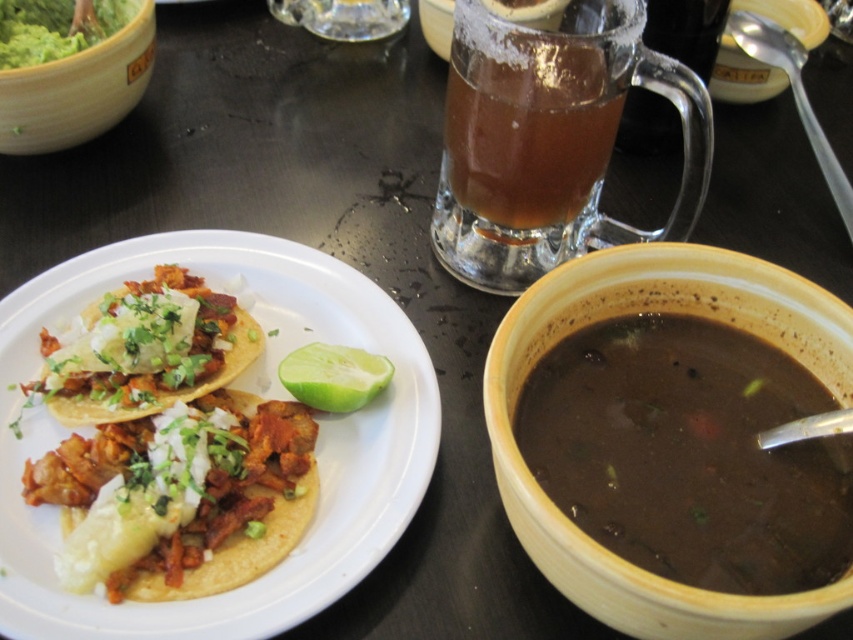
You are a diner sitting at the table in the image. You want to reach for the brown stoneware bowl at center right but need to pass by the shiny silver tacos at left. Can you move your hand from the tacos to the bowl without moving any objects?

Yes, you can move your hand from the shiny silver tacos at left to the brown stoneware bowl at center right because the bowl is positioned to the right of the tacos, allowing a clear path between them.

You are a food critic evaluating the meal setup on the dark wooden table. You notice two shiny silver items at the left side of the table. Which one is shorter in height between the shiny silver taco at left and the shiny silver tacos at left?

The shiny silver taco at left is shorter in height compared to the shiny silver tacos at left.